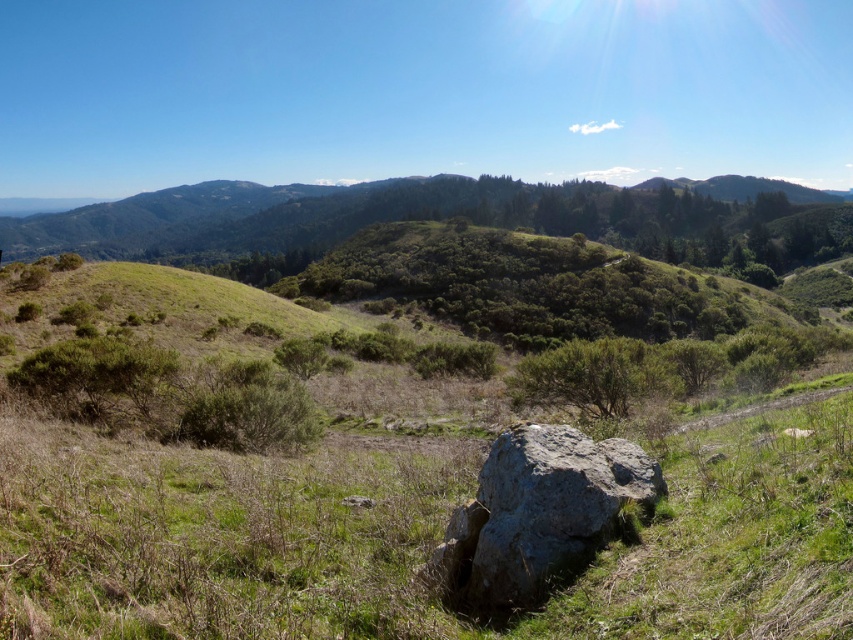
Question: Does green grassy at center come behind green grassy hill at upper center?

Choices:
 (A) no
 (B) yes

Answer: (A)

Question: Can you confirm if green grassy at center is wider than gray rough rock at center?

Choices:
 (A) no
 (B) yes

Answer: (B)

Question: Which point is farther to the camera?

Choices:
 (A) (83, 250)
 (B) (245, 355)

Answer: (A)

Question: Which of the following is the closest to the observer?

Choices:
 (A) green grassy hill at upper center
 (B) gray rough rock at center

Answer: (B)

Question: Can you confirm if green grassy at center is positioned to the right of gray rough rock at center?

Choices:
 (A) no
 (B) yes

Answer: (A)

Question: Which point is closer to the camera?

Choices:
 (A) (647, 506)
 (B) (618, 193)

Answer: (A)